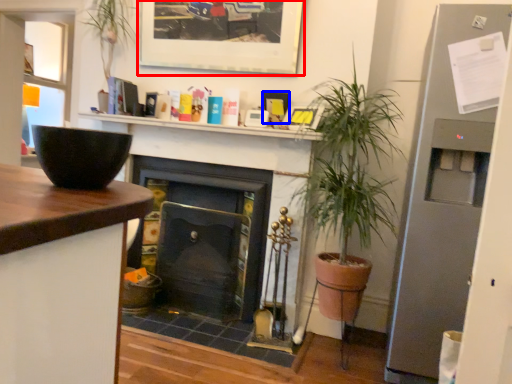
Question: Among these objects, which one is farthest to the camera, picture frame (highlighted by a red box) or picture frame (highlighted by a blue box)?

Choices:
 (A) picture frame
 (B) picture frame

Answer: (B)